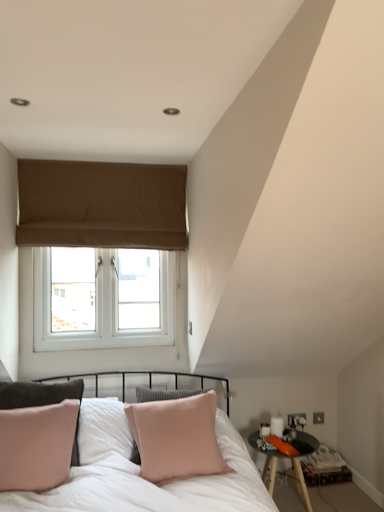
Question: Is pink velvet pillow at center spatially inside brown fabric window at upper center, or outside of it?

Choices:
 (A) outside
 (B) inside

Answer: (A)

Question: Is point (162, 433) positioned closer to the camera than point (21, 196)?

Choices:
 (A) closer
 (B) farther

Answer: (A)

Question: Which of these objects is positioned farthest from the pink velvet pillow at center?

Choices:
 (A) brown fabric window at upper center
 (B) black wooden table at lower right

Answer: (A)

Question: Estimate the real-world distances between objects in this image. Which object is closer to the pink velvet pillow at center?

Choices:
 (A) brown fabric window at upper center
 (B) black wooden table at lower right

Answer: (B)